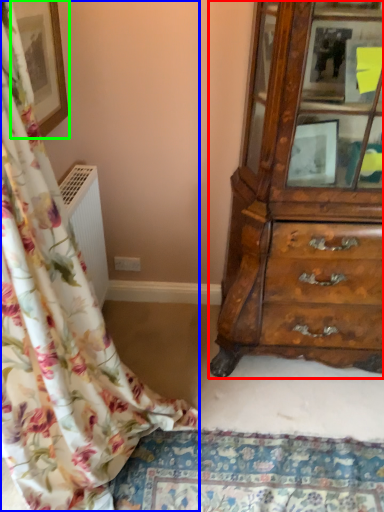
Question: Which object is the farthest from chest of drawers (highlighted by a red box)? Choose among these: curtain (highlighted by a blue box) or picture frame (highlighted by a green box).

Choices:
 (A) curtain
 (B) picture frame

Answer: (B)